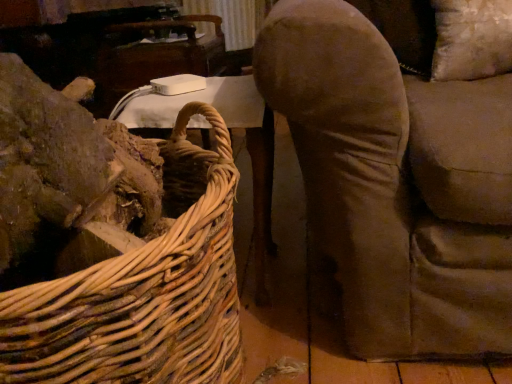
Question: Considering the relative sizes of white plastic table at upper left, which ranks as the second table in back-to-front order, and white plastic table at upper center, marked as the second table in a front-to-back arrangement, in the image provided, is white plastic table at upper left, which ranks as the second table in back-to-front order, taller than white plastic table at upper center, marked as the second table in a front-to-back arrangement,?

Choices:
 (A) yes
 (B) no

Answer: (A)

Question: From a real-world perspective, is white plastic table at upper left, arranged as the 2th table when viewed from the top, on white plastic table at upper center, which appears as the 1th table when viewed from the top?

Choices:
 (A) yes
 (B) no

Answer: (B)

Question: Considering the relative sizes of white plastic table at upper left, arranged as the 2th table when viewed from the top, and white plastic table at upper center, marked as the second table in a front-to-back arrangement, in the image provided, is white plastic table at upper left, arranged as the 2th table when viewed from the top, bigger than white plastic table at upper center, marked as the second table in a front-to-back arrangement,?

Choices:
 (A) no
 (B) yes

Answer: (A)

Question: Is white plastic table at upper left, the 1th table when ordered from bottom to top, oriented away from white plastic table at upper center, positioned as the first table in back-to-front order?

Choices:
 (A) no
 (B) yes

Answer: (B)

Question: Is white plastic table at upper left, arranged as the 2th table when viewed from the top, located outside white plastic table at upper center, the 2th table from the bottom?

Choices:
 (A) yes
 (B) no

Answer: (A)

Question: Can white plastic table at upper center, marked as the second table in a front-to-back arrangement, be found inside white plastic table at upper left, positioned as the 1th table in front-to-back order?

Choices:
 (A) no
 (B) yes

Answer: (A)

Question: Are woven natural wood picnic basket at left and white plastic table at upper center, positioned as the first table in back-to-front order, making contact?

Choices:
 (A) yes
 (B) no

Answer: (B)

Question: Can you confirm if woven natural wood picnic basket at left is thinner than white plastic table at upper center, the 2th table from the bottom?

Choices:
 (A) yes
 (B) no

Answer: (B)

Question: Would you say white plastic table at upper center, which appears as the 1th table when viewed from the top, is part of woven natural wood picnic basket at left's contents?

Choices:
 (A) no
 (B) yes

Answer: (A)

Question: From a real-world perspective, does woven natural wood picnic basket at left stand above white plastic table at upper center, marked as the second table in a front-to-back arrangement?

Choices:
 (A) yes
 (B) no

Answer: (B)

Question: From the image's perspective, does woven natural wood picnic basket at left appear lower than white plastic table at upper center, positioned as the first table in back-to-front order?

Choices:
 (A) no
 (B) yes

Answer: (B)

Question: Is woven natural wood picnic basket at left further to camera compared to white plastic table at upper center, marked as the second table in a front-to-back arrangement?

Choices:
 (A) no
 (B) yes

Answer: (A)

Question: Would you say white plastic table at upper left, which ranks as the second table in back-to-front order, is outside woven natural wood picnic basket at left?

Choices:
 (A) yes
 (B) no

Answer: (A)